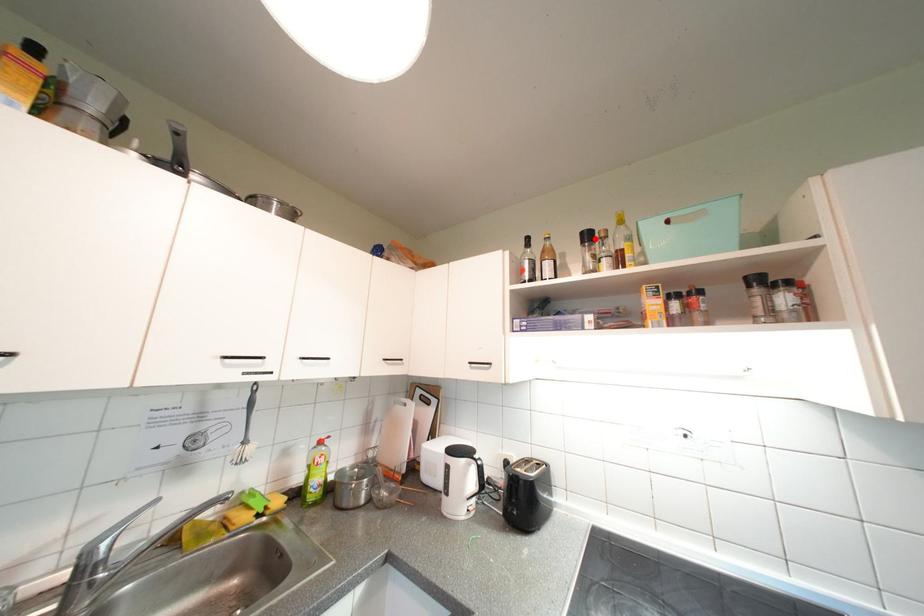
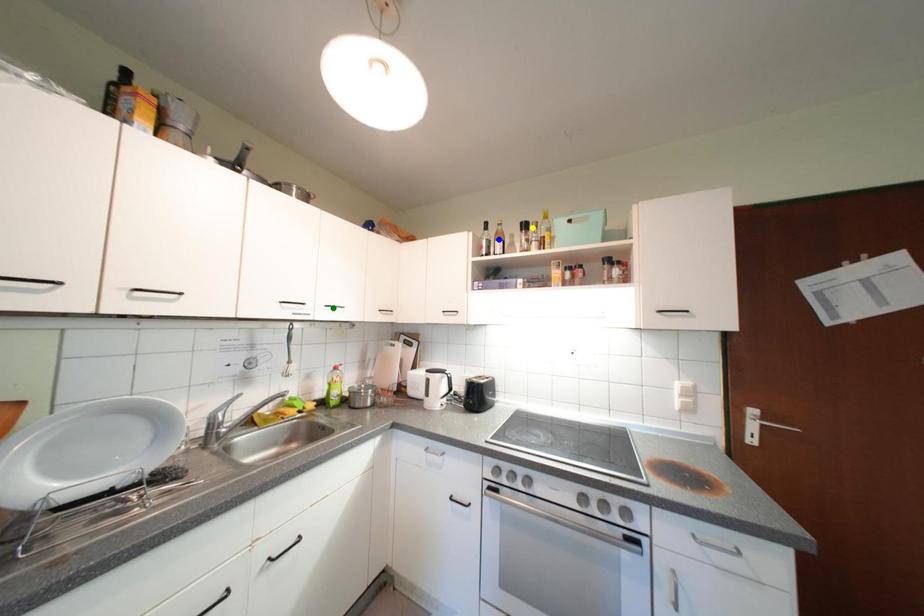
Question: I am providing you with two images of the same scene from different viewpoints. A red point is marked on the first image. You are given multiple points on the second image. In image 2, which mark is for the same physical point as the one in image 1?

Choices:
 (A) yellow point
 (B) blue point
 (C) green point

Answer: (A)